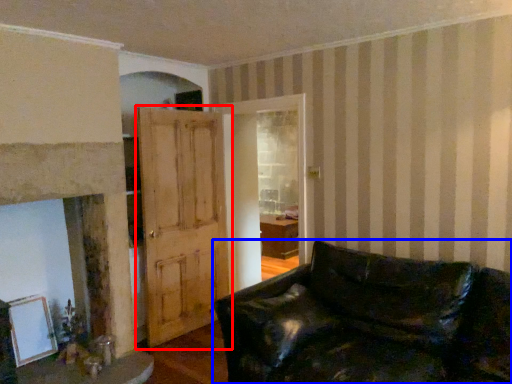
Question: Which object appears farthest to the camera in this image, door (highlighted by a red box) or studio couch (highlighted by a blue box)?

Choices:
 (A) door
 (B) studio couch

Answer: (A)